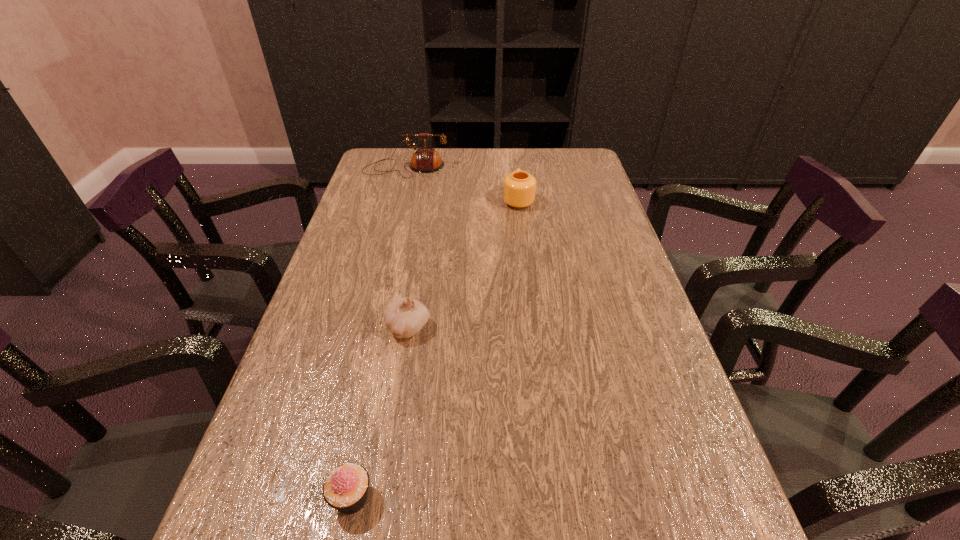
At what (x,y) coordinates should I click in order to perform the action: click on vacant position located on the front of the second nearest object. Please return your answer as a coordinate pair (x, y). Looking at the image, I should click on (390, 439).

What are the coordinates of `free space located 0.050m on the right of the nearest object` in the screenshot? It's located at (405, 498).

Image resolution: width=960 pixels, height=540 pixels. Find the location of `object located in the far edge section of the desktop`. object located in the far edge section of the desktop is located at coordinates (425, 160).

At what (x,y) coordinates should I click in order to perform the action: click on telephone situated at the left edge. Please return your answer as a coordinate pair (x, y). Looking at the image, I should click on (425, 160).

At what (x,y) coordinates should I click in order to perform the action: click on cupcake located in the left edge section of the desktop. Please return your answer as a coordinate pair (x, y). Looking at the image, I should click on (346, 487).

Locate an element on the screen. Image resolution: width=960 pixels, height=540 pixels. object situated at the far left corner is located at coordinates (425, 160).

The image size is (960, 540). Identify the location of vacant space at the far edge of the desktop. (468, 175).

In the image, there is a desktop. Where is `vacant space at the left edge`? vacant space at the left edge is located at coordinates (257, 433).

I want to click on vacant space at the right edge of the desktop, so click(593, 277).

Locate an element on the screen. The height and width of the screenshot is (540, 960). blank area at the far right corner is located at coordinates (551, 179).